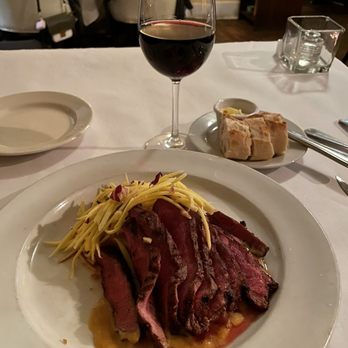
You are a GUI agent. You are given a task and a screenshot of the screen. Output one action in this format:
    pyautogui.click(x=<x>, y=<y>)
    Task: Click on the plate rim
    The height and width of the screenshot is (348, 348).
    Given the screenshot: What is the action you would take?
    (x=279, y=213)